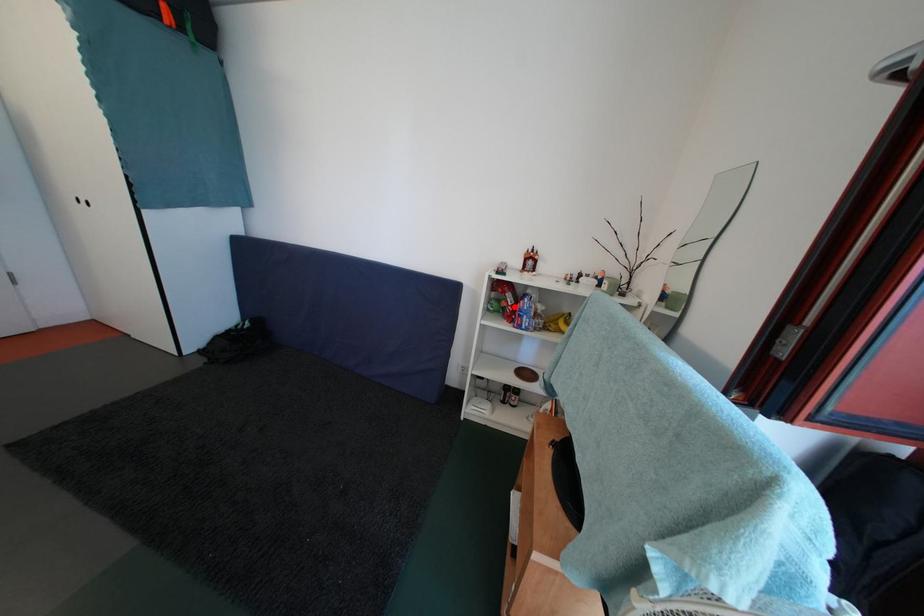
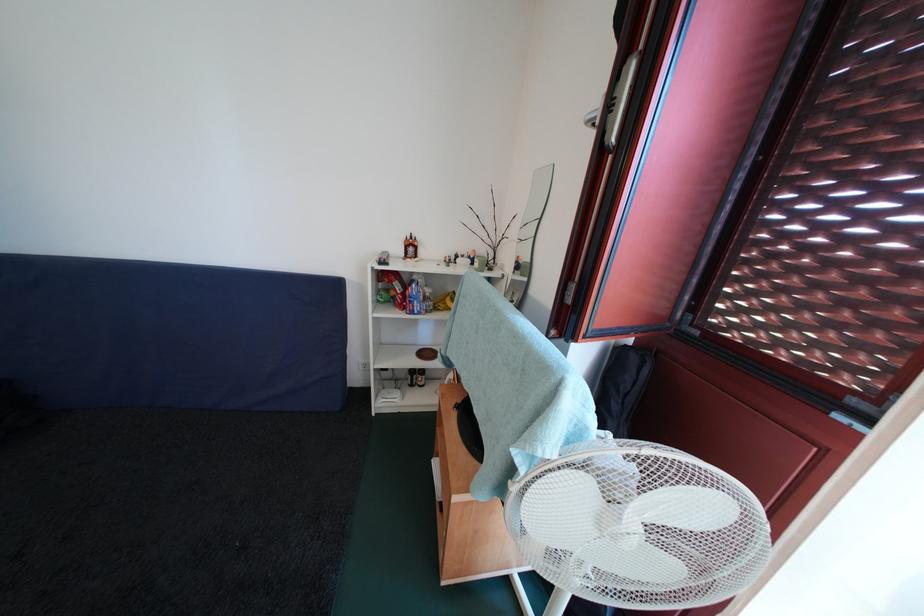
Find the pixel in the second image that matches the highlighted location in the first image.

(403, 296)